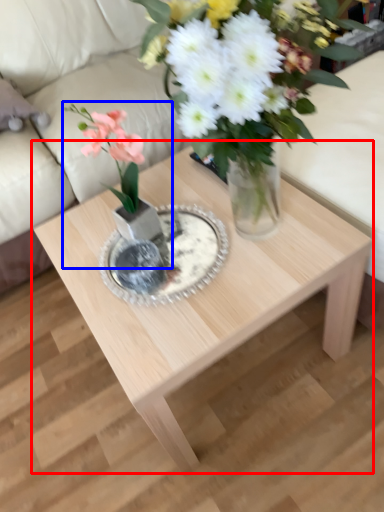
Question: Which object appears closest to the camera in this image, coffee table (highlighted by a red box) or houseplant (highlighted by a blue box)?

Choices:
 (A) coffee table
 (B) houseplant

Answer: (A)